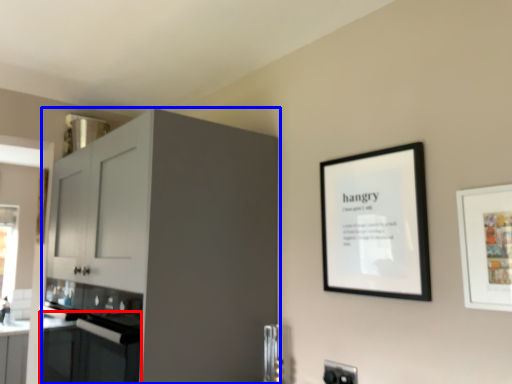
Question: Which of the following is the farthest to the observer, oven (highlighted by a red box) or cabinetry (highlighted by a blue box)?

Choices:
 (A) oven
 (B) cabinetry

Answer: (A)